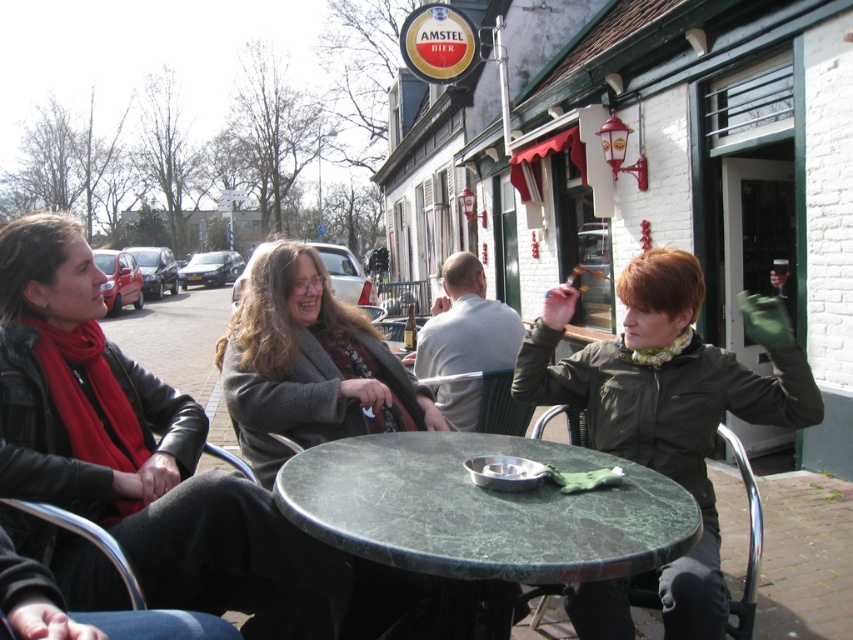
Question: Which object is positioned closest to the leather jacket at left?

Choices:
 (A) green marble table at center
 (B) gray woolen sweater at center

Answer: (B)

Question: Is green marble table at center smaller than gray woolen sweater at center?

Choices:
 (A) no
 (B) yes

Answer: (B)

Question: Estimate the real-world distances between objects in this image. Which object is closer to the leather jacket at left?

Choices:
 (A) green marble table at center
 (B) gray woolen sweater at center

Answer: (B)

Question: Can you confirm if leather jacket at left is positioned below gray woolen sweater at center?

Choices:
 (A) yes
 (B) no

Answer: (A)

Question: Which of these objects is positioned farthest from the leather jacket at left?

Choices:
 (A) green marble table at center
 (B) gray woolen sweater at center

Answer: (A)

Question: Is leather jacket at left above gray woolen sweater at center?

Choices:
 (A) no
 (B) yes

Answer: (A)